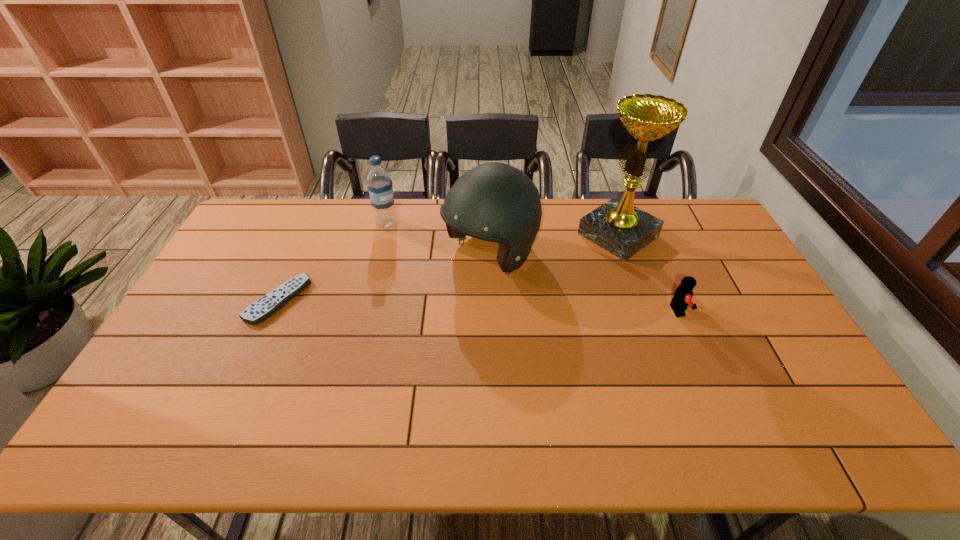
This screenshot has width=960, height=540. What are the coordinates of `the shortest object` in the screenshot? It's located at (263, 308).

The width and height of the screenshot is (960, 540). I want to click on the leftmost object, so click(263, 308).

Find the location of a particular element. Image resolution: width=960 pixels, height=540 pixels. the second shortest object is located at coordinates (682, 297).

Identify the location of the tallest object. The image size is (960, 540). (617, 226).

Locate an element on the screen. The image size is (960, 540). the second tallest object is located at coordinates (496, 202).

The height and width of the screenshot is (540, 960). I want to click on football helmet, so click(496, 202).

This screenshot has height=540, width=960. Find the location of `the third shortest object`. the third shortest object is located at coordinates (379, 181).

The width and height of the screenshot is (960, 540). I want to click on water bottle, so click(x=379, y=181).

Where is `vacant space located 0.100m on the front of the leftmost object`? The width and height of the screenshot is (960, 540). vacant space located 0.100m on the front of the leftmost object is located at coordinates (253, 355).

Where is `free spot located on the front-facing side of the second shortest object`? This screenshot has height=540, width=960. free spot located on the front-facing side of the second shortest object is located at coordinates (762, 310).